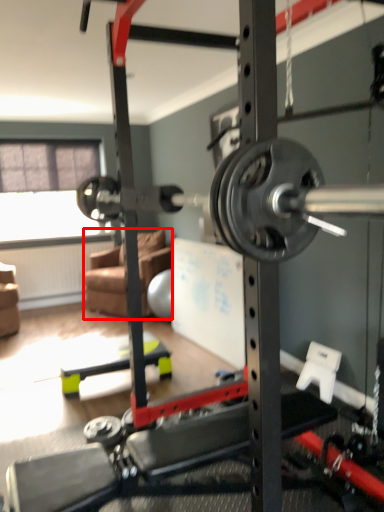
Question: From the image's perspective, where is couch (annotated by the red box) located relative to window screen?

Choices:
 (A) below
 (B) above

Answer: (A)